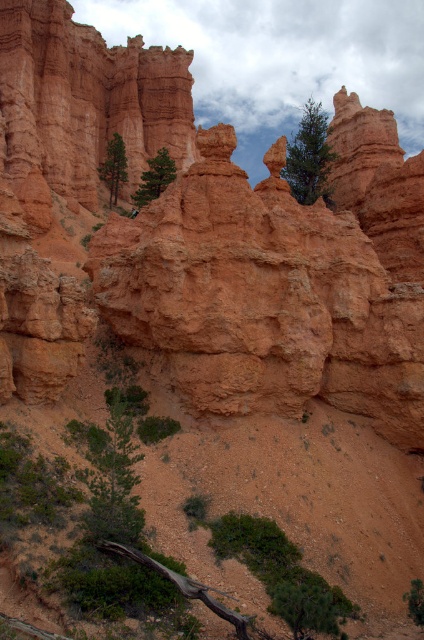
Question: Based on their relative distances, which object is farther from the green leafy tree at lower right?

Choices:
 (A) green leafy tree at lower left
 (B) green textured tree at upper center
 (C) green matte tree at center

Answer: (C)

Question: From the image, what is the correct spatial relationship of green matte tree at upper center in relation to green leafy tree at lower right?

Choices:
 (A) right
 (B) left

Answer: (B)

Question: Which object is positioned closest to the green leafy tree at lower left?

Choices:
 (A) green leafy tree at lower right
 (B) green matte tree at upper center
 (C) green textured tree at upper center
 (D) green matte tree at center

Answer: (A)

Question: Among these objects, which one is nearest to the camera?

Choices:
 (A) green leafy tree at lower left
 (B) green matte tree at center
 (C) green leafy tree at lower right
 (D) green textured tree at upper center

Answer: (A)

Question: Considering the relative positions of green textured tree at upper center and green matte tree at upper center in the image provided, where is green textured tree at upper center located with respect to green matte tree at upper center?

Choices:
 (A) left
 (B) right

Answer: (B)

Question: Observing the image, what is the correct spatial positioning of green matte tree at center in reference to green leafy tree at lower right?

Choices:
 (A) above
 (B) below

Answer: (A)